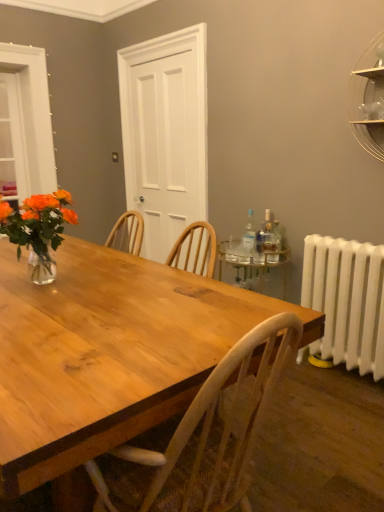
Locate an element on the screen. transparent plastic bottle at right, which is the first bottle in left-to-right order is located at coordinates (249, 234).

This screenshot has height=512, width=384. Identify the location of clear glass shelf at upper right. (368, 99).

Find the location of `clear glass window at upper left`. clear glass window at upper left is located at coordinates (25, 124).

You are a GUI agent. You are given a task and a screenshot of the screen. Output one action in this format:
    pyautogui.click(x=<x>, y=<y>)
    Task: Click on the white painted radiator at right
    This screenshot has width=384, height=512.
    Given the screenshot: What is the action you would take?
    pyautogui.click(x=346, y=300)

This screenshot has height=512, width=384. What do you see at coordinates (38, 229) in the screenshot?
I see `translucent glass vase at left` at bounding box center [38, 229].

Identify the location of white matte door at center. Image resolution: width=384 pixels, height=512 pixels. (165, 134).

This screenshot has width=384, height=512. I want to click on glass door on the right of clear glass window at upper left, so click(165, 134).

Between point (9, 123) and point (124, 85), which one is positioned in front?

The point (9, 123) is closer.

Is clear glass window at upper left wider than white matte door at center?

No, clear glass window at upper left is not wider than white matte door at center.

Is clear glass bottle at right, which ranks as the 3th bottle in left-to-right order, bigger than translucent glass vase at left?

No.

Between clear glass bottle at right, which ranks as the 3th bottle in left-to-right order, and translucent glass vase at left, which one has smaller width?

clear glass bottle at right, which ranks as the 3th bottle in left-to-right order.

Which is in front, point (276, 223) or point (49, 232)?

The point (49, 232) is closer to the camera.

Measure the distance between clear glass bottle at right, which ranks as the 3th bottle in left-to-right order, and translucent glass vase at left.

clear glass bottle at right, which ranks as the 3th bottle in left-to-right order, is 1.56 meters away from translucent glass vase at left.

Is clear glass window at upper left further to camera compared to clear glass shelf at upper right?

Yes, it is behind clear glass shelf at upper right.

From the image's perspective, is clear glass window at upper left beneath clear glass shelf at upper right?

No, from the image's perspective, clear glass window at upper left is not below clear glass shelf at upper right.

This screenshot has width=384, height=512. Identify the location of window below the clear glass shelf at upper right (from a real-world perspective). (25, 124).

In the scene shown: Which object is further away from the camera taking this photo, transparent plastic bottle at right, which is the 3th bottle in right-to-left order, or clear glass window at upper left?

clear glass window at upper left is behind.

Between point (251, 230) and point (16, 95), which one is positioned in front?

Positioned in front is point (251, 230).

Would you say transparent plastic bottle at right, which is the first bottle in left-to-right order, contains clear glass window at upper left?

No, clear glass window at upper left is not a part of transparent plastic bottle at right, which is the first bottle in left-to-right order.

How many degrees apart are the facing directions of wooden table at center and clear glass bottle at right, the 1th bottle positioned from the right?

114 degrees.

In the image, is wooden table at center positioned in front of or behind clear glass bottle at right, the 1th bottle positioned from the right?

wooden table at center is in front of clear glass bottle at right, the 1th bottle positioned from the right.

Is wooden table at center with clear glass bottle at right, which ranks as the 3th bottle in left-to-right order?

No, wooden table at center is not with clear glass bottle at right, which ranks as the 3th bottle in left-to-right order.

Does wooden table at center have a larger size compared to clear glass bottle at right, which ranks as the 3th bottle in left-to-right order?

Correct, wooden table at center is larger in size than clear glass bottle at right, which ranks as the 3th bottle in left-to-right order.

Which object is thinner, clear glass bottle at right, the 1th bottle positioned from the right, or white painted radiator at right?

clear glass bottle at right, the 1th bottle positioned from the right.

Based on the photo, from a real-world perspective, which is physically above, clear glass bottle at right, the 1th bottle positioned from the right, or white painted radiator at right?

From a 3D spatial view, clear glass bottle at right, the 1th bottle positioned from the right, is above.

Starting from the white painted radiator at right, which bottle is the 1st one to the left? Please provide its 2D coordinates.

[(277, 237)]

From the image's perspective, is clear glass bottle at right, the 1th bottle positioned from the right, positioned above or below white painted radiator at right?

Based on their image positions, clear glass bottle at right, the 1th bottle positioned from the right, is located above white painted radiator at right.

Between white matte door at center and clear glass window at upper left, which one appears on the left side from the viewer's perspective?

From the viewer's perspective, clear glass window at upper left appears more on the left side.

Find the location of a particular element. The image size is (384, 512). window below the white matte door at center (from a real-world perspective) is located at coordinates (25, 124).

Based on the photo, is white matte door at center wider or thinner than clear glass window at upper left?

white matte door at center is wider than clear glass window at upper left.

From the image's perspective, is white matte door at center on top of clear glass window at upper left?

Incorrect, from the image's perspective, white matte door at center is lower than clear glass window at upper left.

I want to click on window on the left of white matte door at center, so click(x=25, y=124).

At what (x,y) coordinates should I click in order to perform the action: click on the 2nd bottle below the translucent glass vase at left (from a real-world perspective). Please return your answer as a coordinate pair (x, y). Looking at the image, I should click on (277, 237).

Based on their spatial positions, is clear glass bottle at right, which ranks as the 3th bottle in left-to-right order, or wooden table at center further from translucent glass bottle at right, which is the 2th bottle in left-to-right order?

The object further to translucent glass bottle at right, which is the 2th bottle in left-to-right order, is wooden table at center.

Looking at the image, which one is located closer to clear glass shelf at upper right, translucent glass bottle at right, which is the 2th bottle in left-to-right order, or wooden table at center?

Among the two, translucent glass bottle at right, which is the 2th bottle in left-to-right order, is located nearer to clear glass shelf at upper right.

Which object lies nearer to the anchor point white painted radiator at right, translucent glass vase at left or clear glass window at upper left?

translucent glass vase at left.

Looking at the image, which one is located further to white painted radiator at right, white matte door at center or clear glass bottle at right, which ranks as the 3th bottle in left-to-right order?

Based on the image, white matte door at center appears to be further to white painted radiator at right.

Considering their positions, is clear glass shelf at upper right positioned further to translucent glass bottle at right, which is the 2th bottle in left-to-right order, than translucent glass vase at left?

translucent glass vase at left is further to translucent glass bottle at right, which is the 2th bottle in left-to-right order.

Looking at the image, which one is located further to clear glass window at upper left, translucent glass bottle at right, which is the 2th bottle in left-to-right order, or white matte door at center?

translucent glass bottle at right, which is the 2th bottle in left-to-right order.

Estimate the real-world distances between objects in this image. Which object is further from wooden table at center, transparent plastic bottle at right, which is the 3th bottle in right-to-left order, or translucent glass bottle at right, which is the 2th bottle in left-to-right order?

translucent glass bottle at right, which is the 2th bottle in left-to-right order, is positioned further to the anchor wooden table at center.

Which object lies nearer to the anchor point translucent glass bottle at right, which is the 2th bottle in left-to-right order, white matte door at center or clear glass bottle at right, which ranks as the 3th bottle in left-to-right order?

Among the two, clear glass bottle at right, which ranks as the 3th bottle in left-to-right order, is located nearer to translucent glass bottle at right, which is the 2th bottle in left-to-right order.

I want to click on houseplant between clear glass window at upper left and clear glass shelf at upper right, so click(x=38, y=229).

Locate an element on the screen. The height and width of the screenshot is (512, 384). bottle between wooden table at center and clear glass bottle at right, which ranks as the 3th bottle in left-to-right order, along the z-axis is located at coordinates (270, 242).

Where is `radiator located between wooden table at center and translucent glass bottle at right, which is counted as the second bottle, starting from the right, in the depth direction`? This screenshot has width=384, height=512. radiator located between wooden table at center and translucent glass bottle at right, which is counted as the second bottle, starting from the right, in the depth direction is located at coordinates (346, 300).

Identify the location of radiator between wooden table at center and clear glass bottle at right, which ranks as the 3th bottle in left-to-right order, along the z-axis. This screenshot has width=384, height=512. (346, 300).